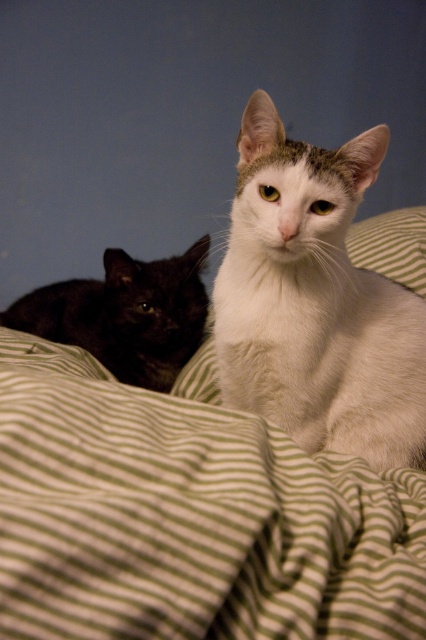
Question: Which object is the farthest from the green striped pillow at center?

Choices:
 (A) white fluffy cat at center
 (B) green striped blanket at center

Answer: (B)

Question: Is white fluffy cat at center to the left of green striped pillow at center from the viewer's perspective?

Choices:
 (A) yes
 (B) no

Answer: (A)

Question: Estimate the real-world distances between objects in this image. Which object is closer to the green striped blanket at center?

Choices:
 (A) black glossy cat at left
 (B) green striped pillow at center
 (C) white fluffy cat at center

Answer: (C)

Question: Is white fluffy cat at center positioned in front of green striped pillow at center?

Choices:
 (A) yes
 (B) no

Answer: (A)

Question: Is white fluffy cat at center wider than green striped pillow at center?

Choices:
 (A) no
 (B) yes

Answer: (B)

Question: Estimate the real-world distances between objects in this image. Which object is closer to the green striped blanket at center?

Choices:
 (A) black glossy cat at left
 (B) green striped pillow at center

Answer: (B)